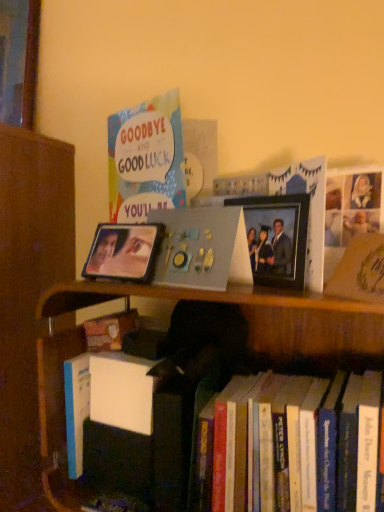
Question: Which direction should I rotate to look at metallic photo frame at center, which is the second picture frame in left-to-right order, — up or down?

Choices:
 (A) up
 (B) down

Answer: (A)

Question: Is hardcover books at lower right bigger than metallic reflective photo frame at center, the 1th picture frame positioned from the left?

Choices:
 (A) yes
 (B) no

Answer: (A)

Question: From a real-world perspective, is hardcover books at lower right under metallic reflective photo frame at center, the 2th picture frame viewed from the right?

Choices:
 (A) yes
 (B) no

Answer: (A)

Question: From the image's perspective, is hardcover books at lower right above metallic reflective photo frame at center, the 2th picture frame viewed from the right?

Choices:
 (A) no
 (B) yes

Answer: (A)

Question: From the image's perspective, is hardcover books at lower right located beneath metallic reflective photo frame at center, the 2th picture frame viewed from the right?

Choices:
 (A) no
 (B) yes

Answer: (B)

Question: From a real-world perspective, is hardcover books at lower right on metallic reflective photo frame at center, the 2th picture frame viewed from the right?

Choices:
 (A) no
 (B) yes

Answer: (A)

Question: Would you say metallic reflective photo frame at center, the 2th picture frame viewed from the right, is part of hardcover books at lower right's contents?

Choices:
 (A) yes
 (B) no

Answer: (B)

Question: Does matte gray photo album at center have a smaller size compared to metallic photo frame at center, which is the second picture frame in left-to-right order?

Choices:
 (A) no
 (B) yes

Answer: (A)

Question: Is matte gray photo album at center not inside metallic photo frame at center, which is the second picture frame in left-to-right order?

Choices:
 (A) yes
 (B) no

Answer: (A)

Question: Does matte gray photo album at center have a lesser height compared to metallic photo frame at center, the first picture frame positioned from the right?

Choices:
 (A) yes
 (B) no

Answer: (B)

Question: Is matte gray photo album at center thinner than metallic photo frame at center, which is the second picture frame in left-to-right order?

Choices:
 (A) yes
 (B) no

Answer: (B)

Question: From the image's perspective, is matte gray photo album at center located beneath metallic photo frame at center, the first picture frame positioned from the right?

Choices:
 (A) yes
 (B) no

Answer: (A)

Question: Is matte gray photo album at center not near metallic photo frame at center, which is the second picture frame in left-to-right order?

Choices:
 (A) yes
 (B) no

Answer: (B)

Question: Is metallic photo frame at center, the first picture frame positioned from the right, not close to metallic reflective photo frame at center, the 1th picture frame positioned from the left?

Choices:
 (A) yes
 (B) no

Answer: (B)